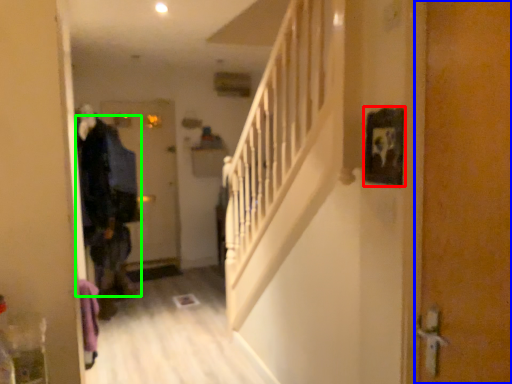
Question: Considering the real-world distances, which object is farthest from picture frame (highlighted by a red box)? door (highlighted by a blue box) or clothing (highlighted by a green box)?

Choices:
 (A) door
 (B) clothing

Answer: (B)